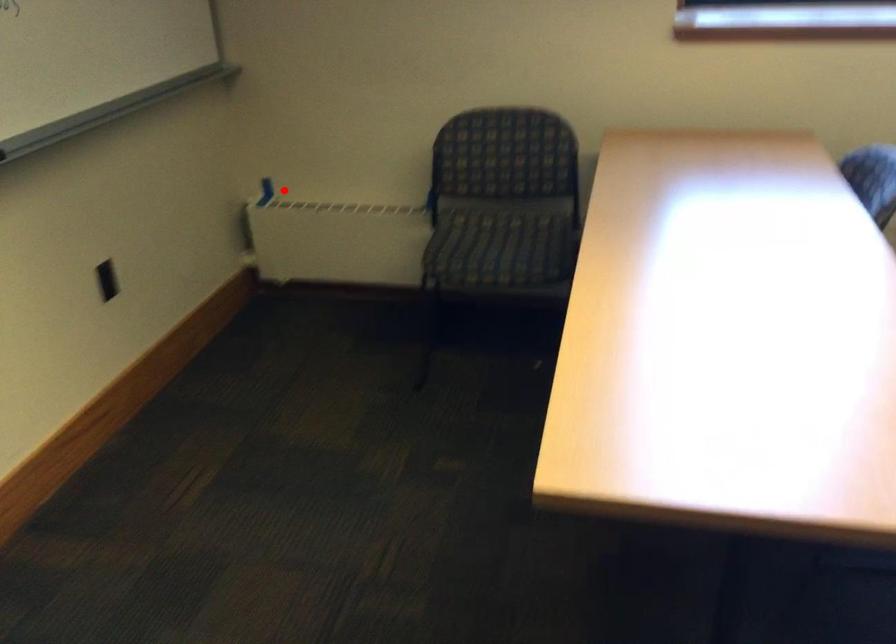
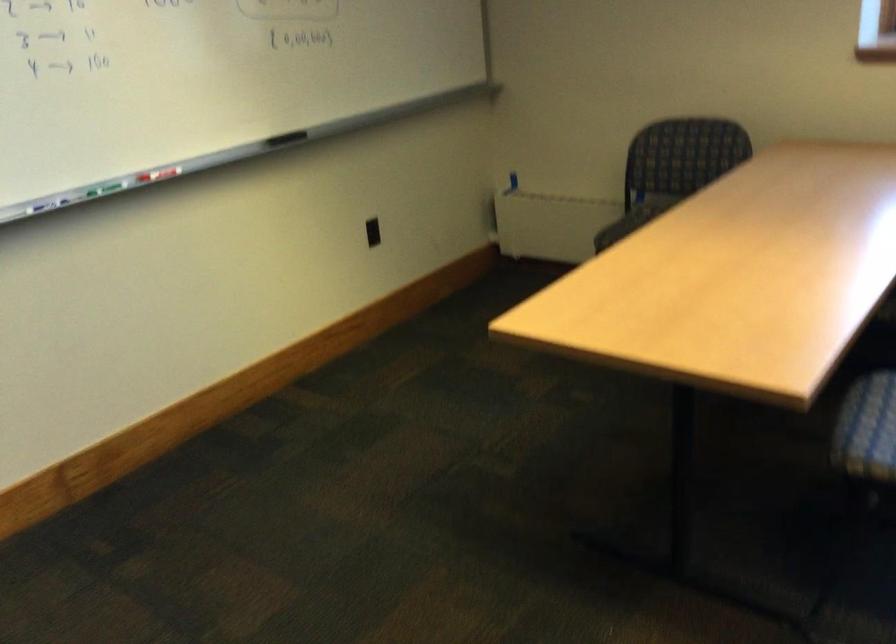
The point at the highlighted location is marked in the first image. Where is the corresponding point in the second image?

(513, 180)